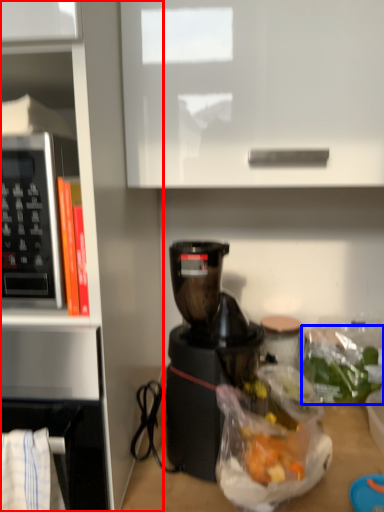
Question: Which object appears farthest to the camera in this image, bookshelf (highlighted by a red box) or food (highlighted by a blue box)?

Choices:
 (A) bookshelf
 (B) food

Answer: (B)